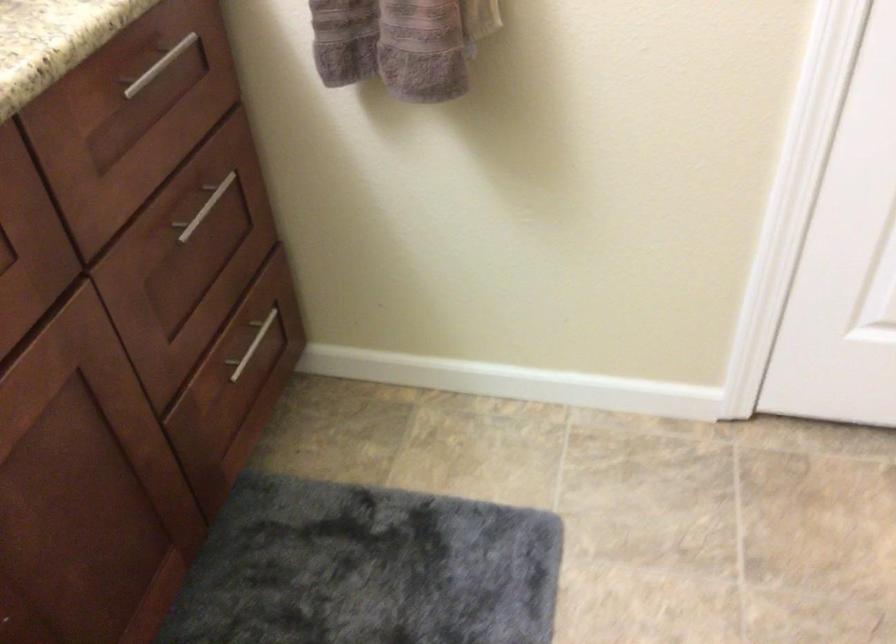
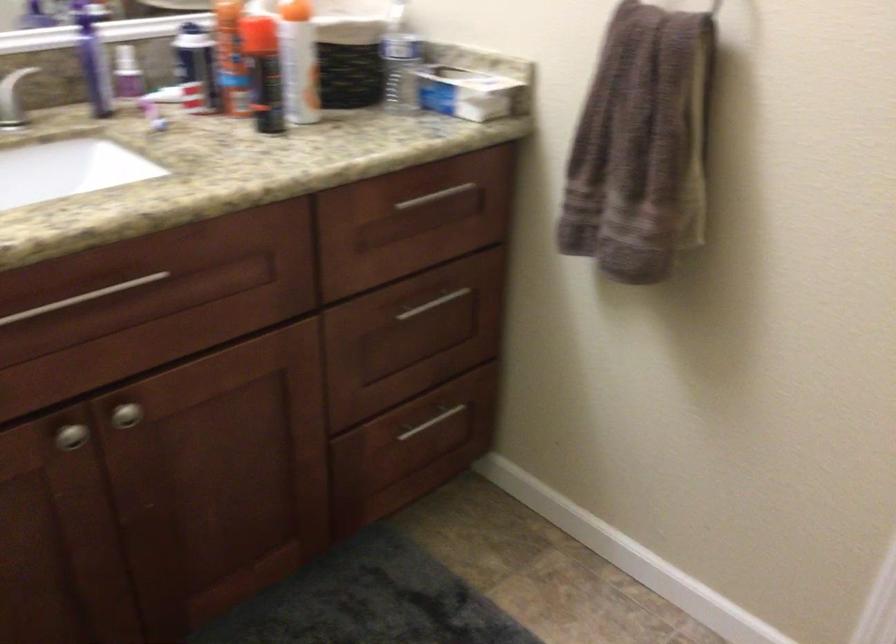
In the second image, find the point that corresponds to [176,70] in the first image.

(445, 201)